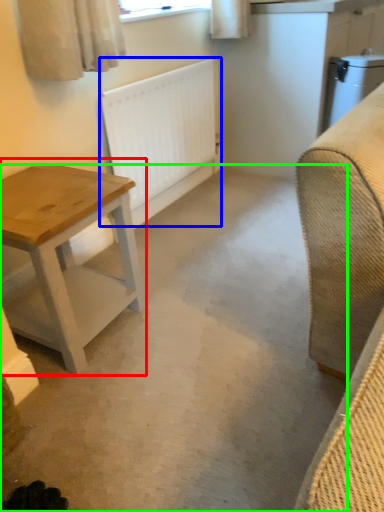
Question: Considering the real-world distances, which object is closest to table (highlighted by a red box)? radiator (highlighted by a blue box) or concrete (highlighted by a green box).

Choices:
 (A) radiator
 (B) concrete

Answer: (B)